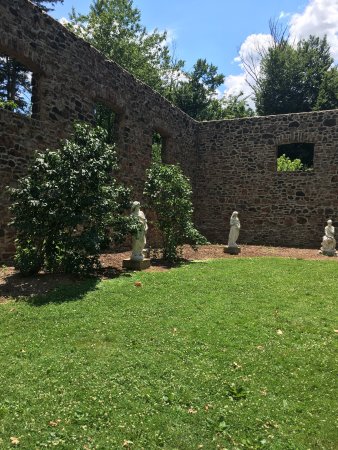
This screenshot has height=450, width=338. What are the coordinates of `window` in the screenshot? It's located at (160, 151).